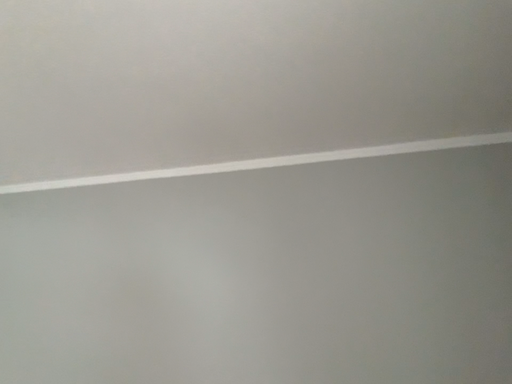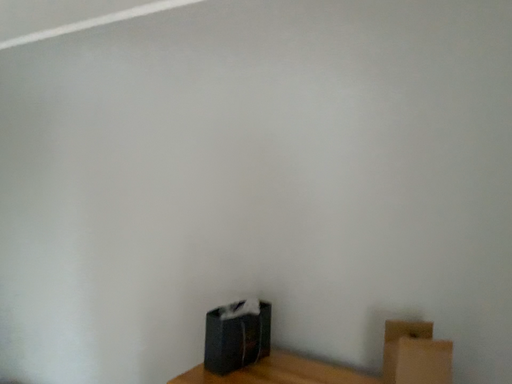
Question: Which way did the camera rotate in the video?

Choices:
 (A) rotated downward
 (B) rotated upward

Answer: (A)